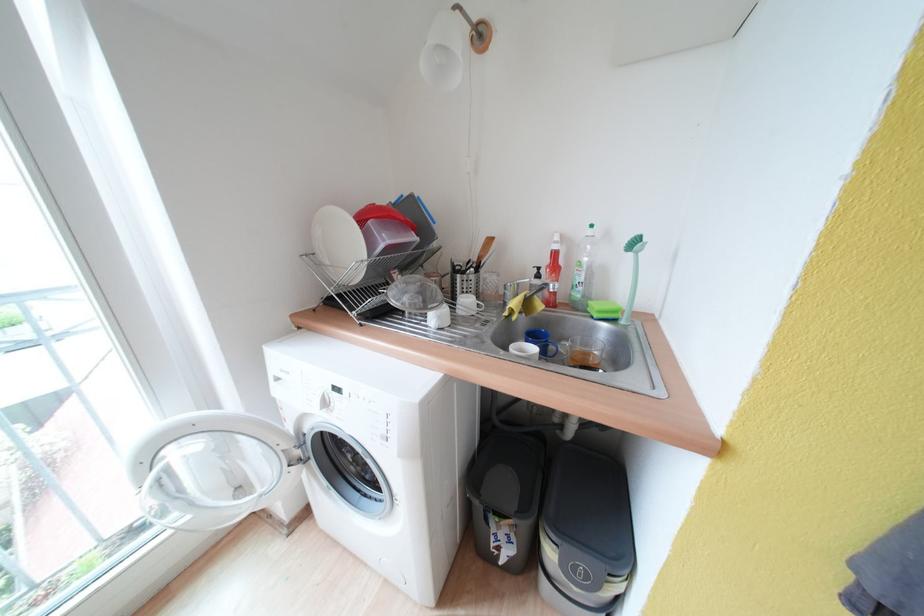
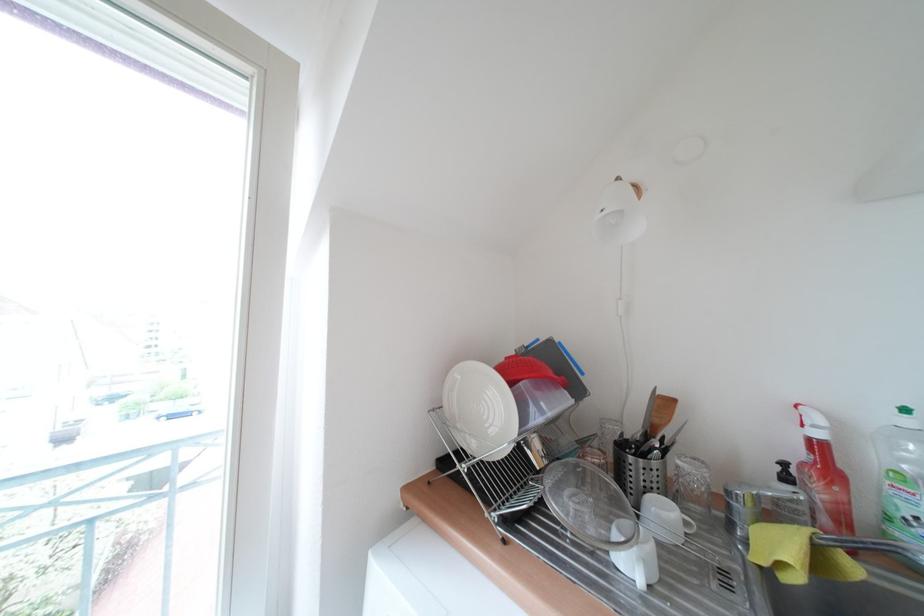
How did the camera likely rotate?

The rotation direction of the camera is left-up.